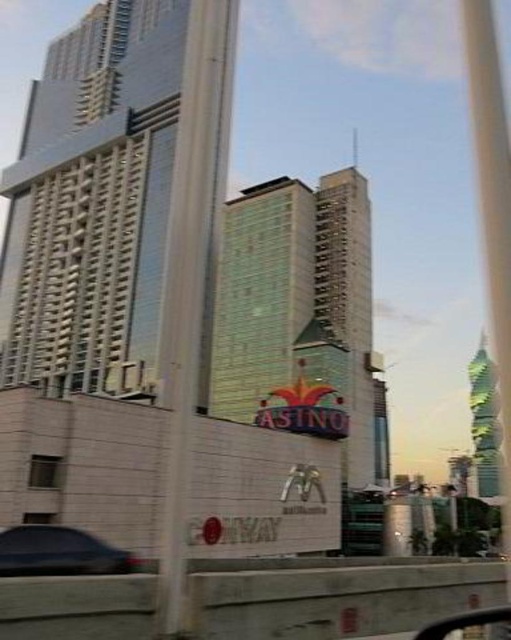
Which is more to the left, glassy reflective skyscraper at upper left or metallic glass pole at center?

glassy reflective skyscraper at upper left

Measure the distance between point (x=148, y=348) and camera.

Point (x=148, y=348) and camera are 80.97 meters apart.

The height and width of the screenshot is (640, 511). What do you see at coordinates (94, 204) in the screenshot?
I see `glassy reflective skyscraper at upper left` at bounding box center [94, 204].

Find the location of a particular element. glassy reflective skyscraper at upper left is located at coordinates (94, 204).

Which is more to the right, green glass tower at upper right or transparent glass window at lower left?

green glass tower at upper right is more to the right.

Identify the location of green glass tower at upper right. (483, 422).

Does metallic glass pole at center appear on the left side of dark gray matte car at lower left?

Indeed, metallic glass pole at center is positioned on the left side of dark gray matte car at lower left.

Can you confirm if metallic glass pole at center is thinner than dark gray matte car at lower left?

Incorrect, metallic glass pole at center's width is not less than dark gray matte car at lower left's.

Where is `metallic glass pole at center`? This screenshot has width=511, height=640. metallic glass pole at center is located at coordinates (188, 285).